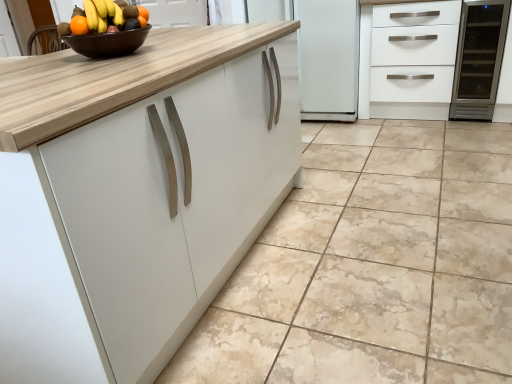
What do you see at coordinates (373, 265) in the screenshot? The width and height of the screenshot is (512, 384). I see `beige marble floor at center` at bounding box center [373, 265].

Measure the distance between point (496, 19) and camera.

Point (496, 19) is 9.42 feet away from camera.

This screenshot has height=384, width=512. What do you see at coordinates (365, 62) in the screenshot? I see `white matte cabinet at upper right` at bounding box center [365, 62].

This screenshot has height=384, width=512. What do you see at coordinates (104, 17) in the screenshot?
I see `orange matte grapefruit at upper left` at bounding box center [104, 17].

You are a GUI agent. You are given a task and a screenshot of the screen. Output one action in this format:
    pyautogui.click(x=<x>, y=<y>)
    Task: Click on the brown glossy bowl at upper center
    The width and height of the screenshot is (512, 384).
    Given the screenshot: What is the action you would take?
    pyautogui.click(x=108, y=43)

How many degrees apart are the facing directions of white matte cabinet at upper right and satin stainless steel wine cooler at right?

white matte cabinet at upper right and satin stainless steel wine cooler at right are facing 0.62 degrees away from each other.

Is the surface of white matte cabinet at upper right in direct contact with satin stainless steel wine cooler at right?

There is a gap between white matte cabinet at upper right and satin stainless steel wine cooler at right.

Which of these two, white matte cabinet at upper right or satin stainless steel wine cooler at right, is smaller?

Smaller between the two is satin stainless steel wine cooler at right.

Locate an element on the screen. The image size is (512, 384). appliance directly beneath the white matte cabinet at upper right (from a real-world perspective) is located at coordinates (479, 59).

Looking at their sizes, would you say brown glossy bowl at upper center is wider or thinner than orange matte grapefruit at upper left?

In the image, brown glossy bowl at upper center appears to be wider than orange matte grapefruit at upper left.

From the picture: Would you say brown glossy bowl at upper center contains orange matte grapefruit at upper left?

Actually, orange matte grapefruit at upper left is outside brown glossy bowl at upper center.

The width and height of the screenshot is (512, 384). I want to click on grapefruit on the left of the brown glossy bowl at upper center, so click(x=104, y=17).

From a real-world perspective, who is located lower, brown glossy bowl at upper center or orange matte grapefruit at upper left?

From a 3D spatial view, brown glossy bowl at upper center is below.

Considering the sizes of objects beige marble floor at center and white matte cabinet at upper right in the image provided, who is smaller, beige marble floor at center or white matte cabinet at upper right?

Smaller between the two is white matte cabinet at upper right.

Is beige marble floor at center directly adjacent to white matte cabinet at upper right?

No, beige marble floor at center is not in contact with white matte cabinet at upper right.

Does point (213, 314) appear closer or farther from the camera than point (360, 17)?

Clearly, point (213, 314) is closer to the camera than point (360, 17).

Based on the photo, is the position of beige marble floor at center more distant than that of white matte cabinet at upper right?

No.

Is white matte cabinet at upper right far away from brown glossy bowl at upper center?

Yes, white matte cabinet at upper right and brown glossy bowl at upper center are located far from each other.

Based on the photo, between white matte cabinet at upper right and brown glossy bowl at upper center, which one has smaller width?

brown glossy bowl at upper center.

Find the location of a particular element. bowl on the left side of white matte cabinet at upper right is located at coordinates (108, 43).

In the scene shown: Between orange matte grapefruit at upper left and beige marble floor at center, which one has more height?

orange matte grapefruit at upper left is taller.

Which object is positioned more to the right, orange matte grapefruit at upper left or beige marble floor at center?

From the viewer's perspective, beige marble floor at center appears more on the right side.

From the picture: How distant is orange matte grapefruit at upper left from beige marble floor at center?

4.55 feet.

Which of these two, orange matte grapefruit at upper left or beige marble floor at center, is bigger?

Bigger between the two is beige marble floor at center.

In the scene shown: Considering the sizes of objects beige marble floor at center and satin stainless steel wine cooler at right in the image provided, who is shorter, beige marble floor at center or satin stainless steel wine cooler at right?

With less height is beige marble floor at center.

Which object is positioned more to the right, beige marble floor at center or satin stainless steel wine cooler at right?

From the viewer's perspective, satin stainless steel wine cooler at right appears more on the right side.

Would you say beige marble floor at center is a long distance from satin stainless steel wine cooler at right?

Absolutely, beige marble floor at center is distant from satin stainless steel wine cooler at right.

Is beige marble floor at center not within satin stainless steel wine cooler at right?

beige marble floor at center is positioned outside satin stainless steel wine cooler at right.

Can you see orange matte grapefruit at upper left touching satin stainless steel wine cooler at right?

They are not placed beside each other.

Which is less distant, (96,15) or (472,8)?

Point (96,15).

Considering the sizes of orange matte grapefruit at upper left and satin stainless steel wine cooler at right in the image, is orange matte grapefruit at upper left wider or thinner than satin stainless steel wine cooler at right?

Clearly, orange matte grapefruit at upper left has less width compared to satin stainless steel wine cooler at right.

From the image's perspective, is orange matte grapefruit at upper left located beneath satin stainless steel wine cooler at right?

Yes, from the image's perspective, orange matte grapefruit at upper left is below satin stainless steel wine cooler at right.

In order to click on appliance that is under the white matte cabinet at upper right (from a real-world perspective) in this screenshot , I will do `click(479, 59)`.

Find the location of a particular element. The image size is (512, 384). grapefruit located on the left of brown glossy bowl at upper center is located at coordinates (104, 17).

Considering their positions, is orange matte grapefruit at upper left positioned closer to satin stainless steel wine cooler at right than white matte cabinet at upper right?

The object closer to satin stainless steel wine cooler at right is white matte cabinet at upper right.

Based on the photo, considering their positions, is orange matte grapefruit at upper left positioned closer to beige marble floor at center than brown glossy bowl at upper center?

Among the two, brown glossy bowl at upper center is located nearer to beige marble floor at center.

Which object lies nearer to the anchor point orange matte grapefruit at upper left, brown glossy bowl at upper center or white matte cabinet at upper right?

brown glossy bowl at upper center is closer to orange matte grapefruit at upper left.

Estimate the real-world distances between objects in this image. Which object is closer to orange matte grapefruit at upper left, beige marble floor at center or white matte cabinet at upper right?

Among the two, beige marble floor at center is located nearer to orange matte grapefruit at upper left.

Based on their spatial positions, is orange matte grapefruit at upper left or beige marble floor at center closer to white matte cabinet at upper right?

beige marble floor at center lies closer to white matte cabinet at upper right than the other object.

Looking at the image, which one is located further to orange matte grapefruit at upper left, satin stainless steel wine cooler at right or brown glossy bowl at upper center?

satin stainless steel wine cooler at right.

Considering their positions, is satin stainless steel wine cooler at right positioned closer to white matte cabinet at upper right than brown glossy bowl at upper center?

satin stainless steel wine cooler at right.

Estimate the real-world distances between objects in this image. Which object is further from beige marble floor at center, brown glossy bowl at upper center or orange matte grapefruit at upper left?

orange matte grapefruit at upper left lies further to beige marble floor at center than the other object.

Image resolution: width=512 pixels, height=384 pixels. Identify the location of bowl located between beige marble floor at center and white matte cabinet at upper right in the depth direction. (108, 43).

You are a GUI agent. You are given a task and a screenshot of the screen. Output one action in this format:
    pyautogui.click(x=<x>, y=<y>)
    Task: Click on the ceramic tile located between brown glossy bowl at upper center and satin stainless steel wine cooler at right in the left-right direction
    The height and width of the screenshot is (384, 512).
    Given the screenshot: What is the action you would take?
    pyautogui.click(x=373, y=265)

Where is `cabinetry between orange matte grapefruit at upper left and satin stainless steel wine cooler at right in the horizontal direction`? cabinetry between orange matte grapefruit at upper left and satin stainless steel wine cooler at right in the horizontal direction is located at coordinates (365, 62).

Locate an element on the screen. The width and height of the screenshot is (512, 384). cabinetry between brown glossy bowl at upper center and satin stainless steel wine cooler at right from left to right is located at coordinates (365, 62).